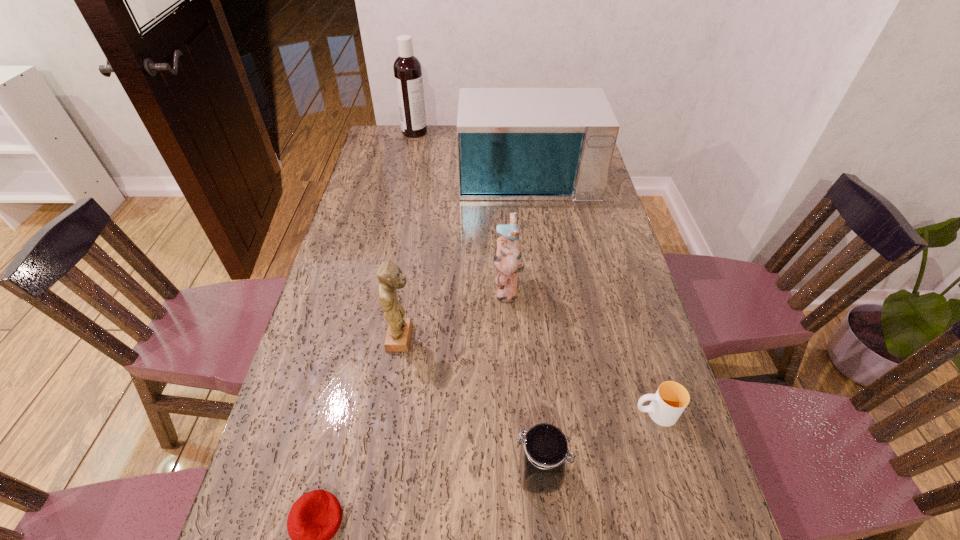
I want to click on free space at the left edge of the desktop, so 368,202.

Find the location of `vacant space at the right edge`. vacant space at the right edge is located at coordinates (670, 448).

Find the location of `free spot at the far left corner of the desktop`. free spot at the far left corner of the desktop is located at coordinates (395, 138).

Where is `empty space that is in between the left figurine and the farther figurine`? This screenshot has height=540, width=960. empty space that is in between the left figurine and the farther figurine is located at coordinates (454, 313).

Where is `free space between the cup and the tallest object`? free space between the cup and the tallest object is located at coordinates (535, 273).

The image size is (960, 540). Identify the location of vacant area that lies between the fifth nearest object and the second shortest object. (581, 350).

At what (x,y) coordinates should I click in order to perform the action: click on blank region between the left figurine and the third shortest object. Please return your answer as a coordinate pair (x, y). The image size is (960, 540). Looking at the image, I should click on (470, 406).

I want to click on empty space that is in between the dishwasher detergent and the right figurine, so click(461, 210).

Image resolution: width=960 pixels, height=540 pixels. Identify the location of free spot between the nearer figurine and the farther figurine. (454, 313).

Find the location of a particular element. Image resolution: width=960 pixels, height=540 pixels. the fourth closest object to the beanbag is located at coordinates (670, 400).